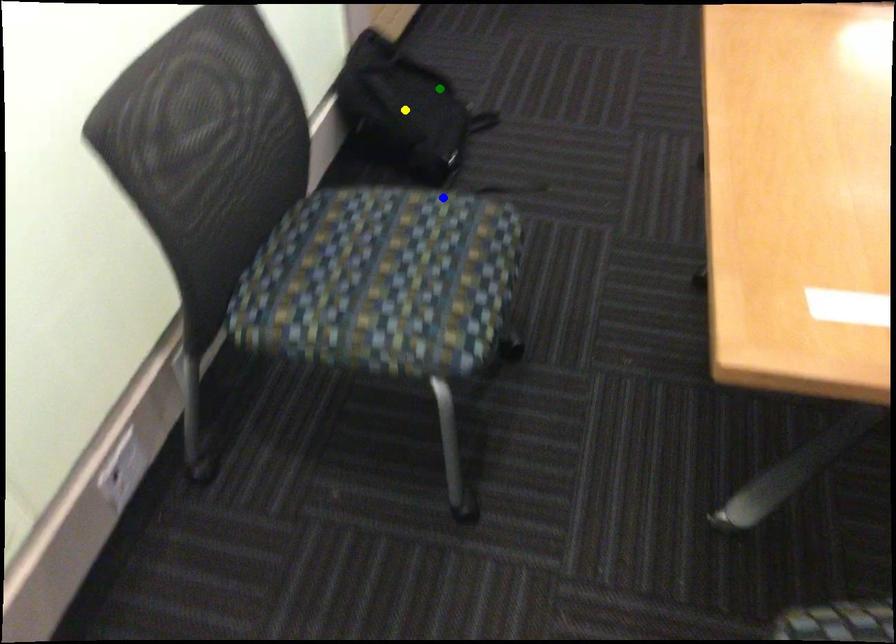
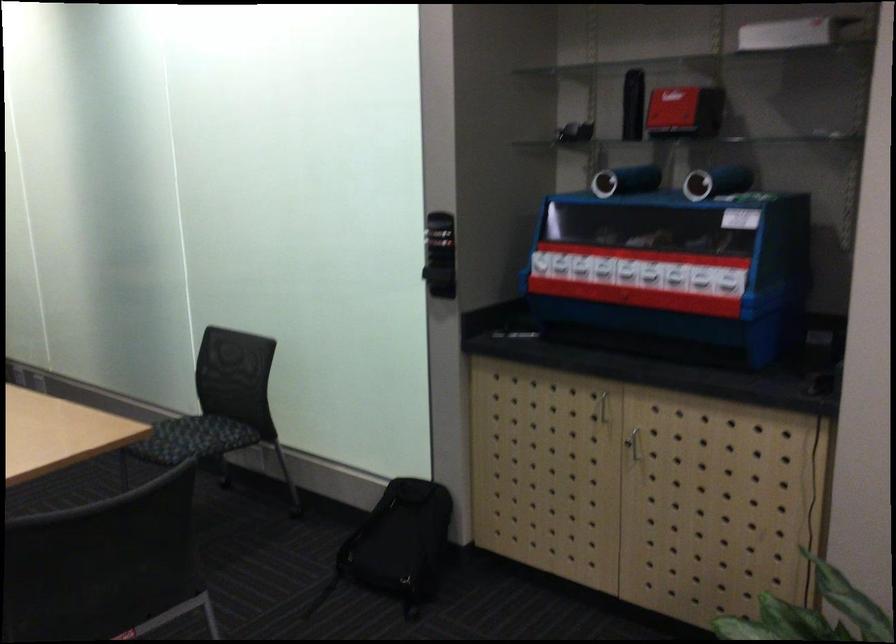
I am providing you with two images of the same scene from different viewpoints. Three points are marked in image1. Which point corresponds to a part or object that is occluded in image2?In image1, three points are marked. Which of them correspond to a part or object that is occluded in image2?Among the three points shown in image1, which one corresponds to a part or object that is no longer visible due to occlusion in image2?

yellow point cannot be seen in image2.